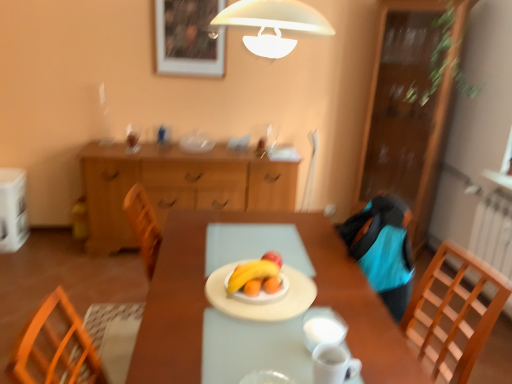
The image size is (512, 384). What are the coordinates of `vacant space behind white glossy mug at center, which ranks as the 3th tableware in front-to-back order` in the screenshot? It's located at (315, 302).